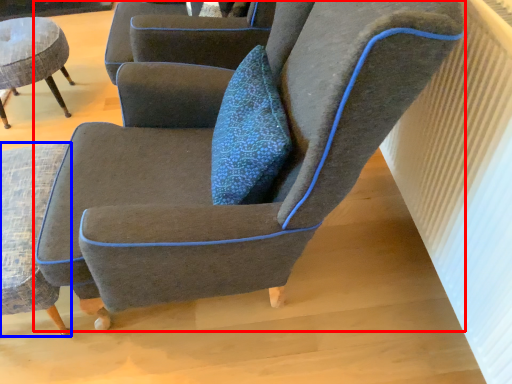
Question: Which object is further to the camera taking this photo, chair (highlighted by a red box) or chair (highlighted by a blue box)?

Choices:
 (A) chair
 (B) chair

Answer: (B)